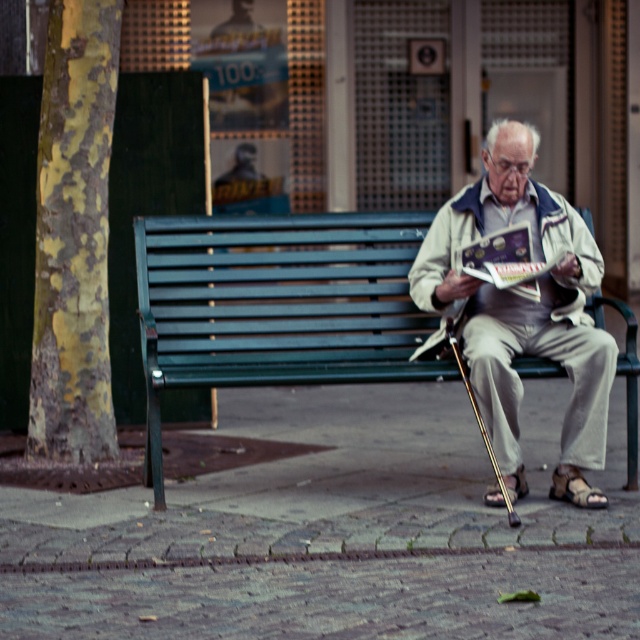
Question: Which point is closer to the camera?

Choices:
 (A) (161, 339)
 (B) (493, 195)

Answer: (B)

Question: Can you confirm if beige fabric jacket at center is bigger than matte paper book at center?

Choices:
 (A) yes
 (B) no

Answer: (A)

Question: Which of the following is the closest to the observer?

Choices:
 (A) beige fabric jacket at center
 (B) matte paper book at center
 (C) green painted wood bench at center

Answer: (A)

Question: Which object is positioned closest to the green painted wood bench at center?

Choices:
 (A) matte paper book at center
 (B) beige fabric jacket at center

Answer: (B)

Question: Is green painted wood bench at center closer to camera compared to matte paper book at center?

Choices:
 (A) yes
 (B) no

Answer: (A)

Question: Is green painted wood bench at center positioned before matte paper book at center?

Choices:
 (A) yes
 (B) no

Answer: (A)